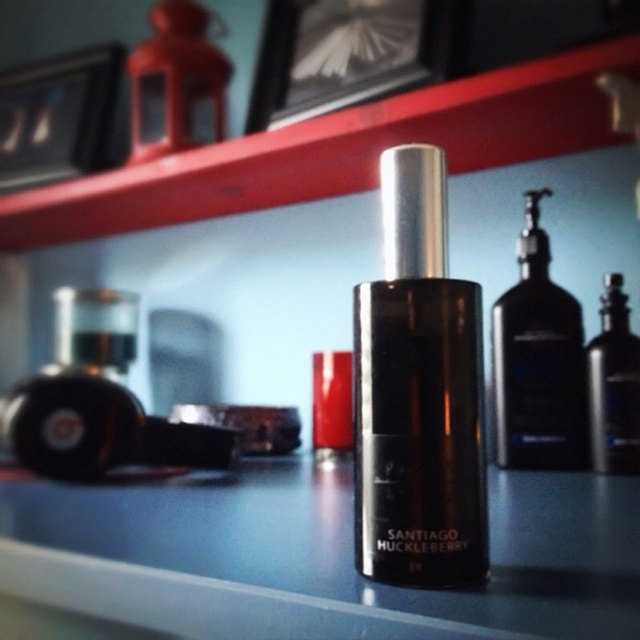
Question: Which object appears closest to the camera in this image?

Choices:
 (A) black glass bottle at center
 (B) matte black bottle at center
 (C) black matte bottle at center
 (D) wooden picture frame at upper left

Answer: (A)

Question: Which object appears farthest from the camera in this image?

Choices:
 (A) wooden picture frame at upper center
 (B) wooden picture frame at upper left
 (C) satin black bottle at center
 (D) matte black bottle at center

Answer: (B)

Question: Is matte black bottle at center to the right of wooden picture frame at upper center from the viewer's perspective?

Choices:
 (A) yes
 (B) no

Answer: (B)

Question: Estimate the real-world distances between objects in this image. Which object is closer to the satin black bottle at center?

Choices:
 (A) matte red lipstick at center
 (B) wooden picture frame at upper left

Answer: (A)

Question: Is black matte bottle at center positioned at the back of satin black bottle at center?

Choices:
 (A) no
 (B) yes

Answer: (B)

Question: Is wooden picture frame at upper center closer to the viewer compared to black matte bottle at center?

Choices:
 (A) yes
 (B) no

Answer: (A)